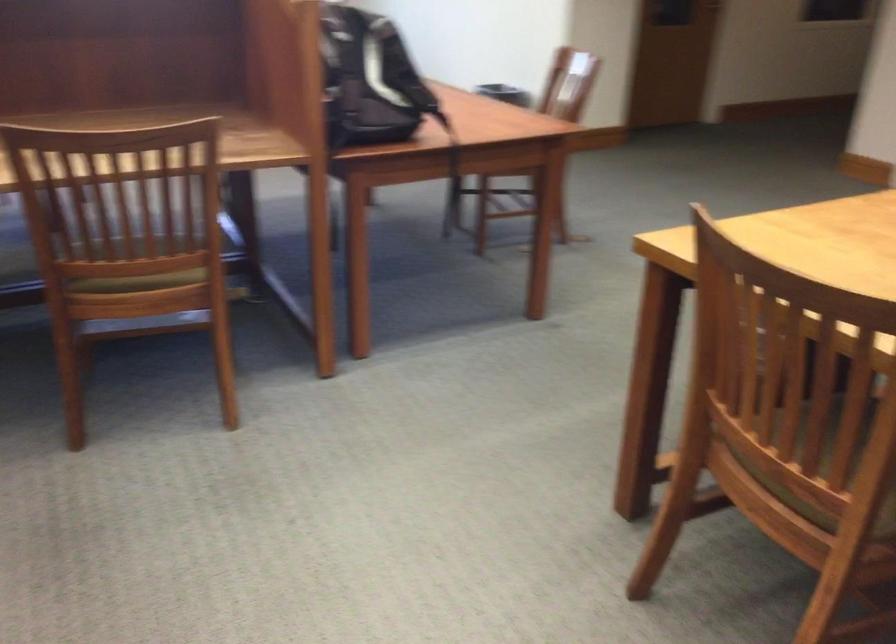
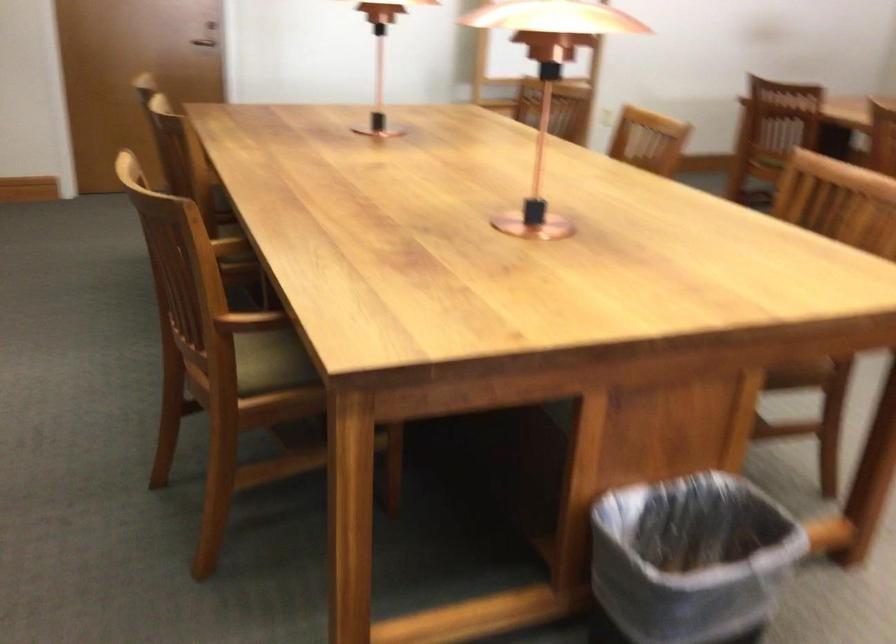
The point at (744,415) is marked in the first image. Where is the corresponding point in the second image?

(799, 374)